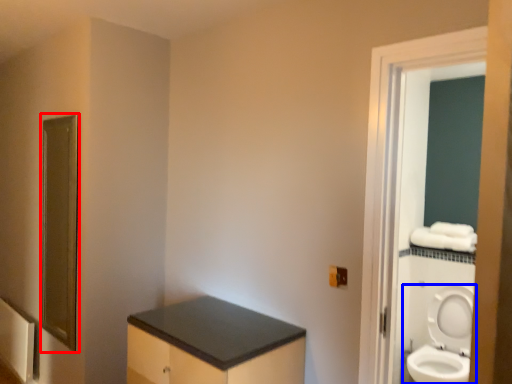
Question: Which point is further to the camera, mirror (highlighted by a red box) or toilet (highlighted by a blue box)?

Choices:
 (A) mirror
 (B) toilet

Answer: (B)